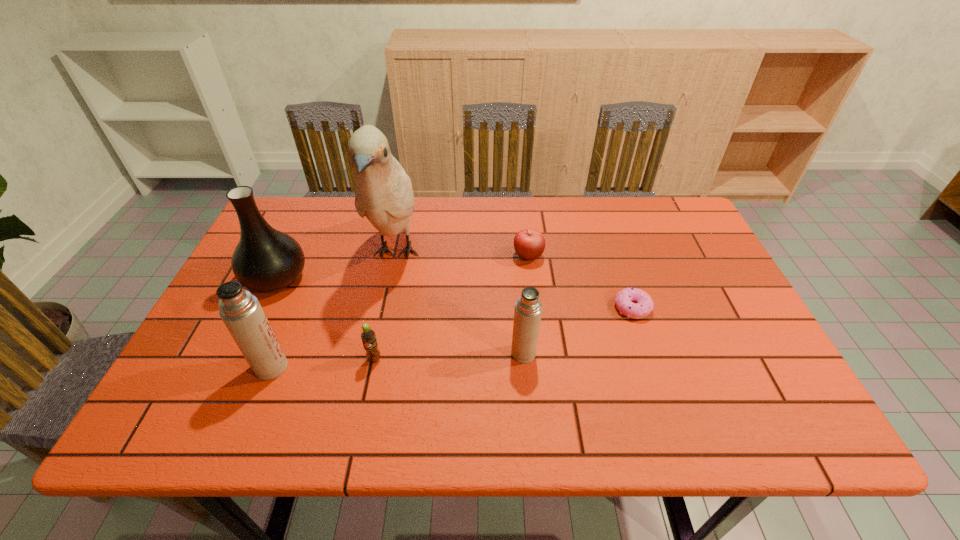
Where is `vacant space in between the vase and the fourth shortest object`? The image size is (960, 540). vacant space in between the vase and the fourth shortest object is located at coordinates (400, 316).

Where is `free space between the doughnut and the fifth tallest object`? The image size is (960, 540). free space between the doughnut and the fifth tallest object is located at coordinates (503, 333).

This screenshot has width=960, height=540. I want to click on empty space that is in between the right thermos bottle and the vase, so click(x=400, y=316).

The height and width of the screenshot is (540, 960). Find the location of `vacant area that lies between the vase and the second shortest object`. vacant area that lies between the vase and the second shortest object is located at coordinates (402, 267).

Identify which object is located as the fifth nearest to the vase. Please provide its 2D coordinates. Your answer should be formatted as a tuple, i.e. [(x, y)], where the tuple contains the x and y coordinates of a point satisfying the conditions above.

[(529, 244)]

Choose which object is the fifth nearest neighbor to the parakeet. Please provide its 2D coordinates. Your answer should be formatted as a tuple, i.e. [(x, y)], where the tuple contains the x and y coordinates of a point satisfying the conditions above.

[(528, 309)]

The height and width of the screenshot is (540, 960). I want to click on free location that satisfies the following two spatial constraints: 1. on the face of the tallest object; 2. on the left side of the rightmost object, so click(385, 308).

The image size is (960, 540). I want to click on free space that satisfies the following two spatial constraints: 1. on the face of the fourth tallest object; 2. on the left side of the parakeet, so click(375, 353).

The width and height of the screenshot is (960, 540). What are the coordinates of `blank space that satisfies the following two spatial constraints: 1. on the front side of the vase; 2. on the right side of the right thermos bottle` in the screenshot? It's located at (241, 353).

Where is `free space that satisfies the following two spatial constraints: 1. on the back side of the taller thermos bottle; 2. on the right side of the doughnut`? This screenshot has width=960, height=540. free space that satisfies the following two spatial constraints: 1. on the back side of the taller thermos bottle; 2. on the right side of the doughnut is located at coordinates (296, 308).